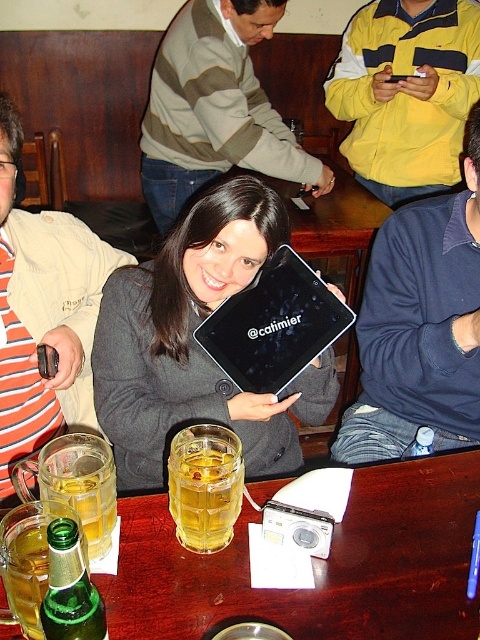
Does translucent glass mug at center have a larger size compared to green glass bottle at lower left?

Indeed, translucent glass mug at center has a larger size compared to green glass bottle at lower left.

Does point (197, 481) lie behind point (52, 557)?

That is True.

Who is more forward, (200, 481) or (48, 625)?

Point (48, 625) is in front.

You are a GUI agent. You are given a task and a screenshot of the screen. Output one action in this format:
    pyautogui.click(x=<x>, y=<y>)
    Task: Click on the translucent glass mug at center
    This screenshot has width=480, height=640.
    Given the screenshot: What is the action you would take?
    pyautogui.click(x=204, y=484)

Is wooden table at center bigger than striped sweater at center?

Incorrect, wooden table at center is not larger than striped sweater at center.

Between point (437, 516) and point (208, 163), which one is positioned in front?

Point (437, 516) is in front.

The width and height of the screenshot is (480, 640). What are the coordinates of `wooden table at center` in the screenshot? It's located at (314, 564).

Which of these two, dark blue sweater at center or green glass beer at lower left, stands shorter?

With less height is green glass beer at lower left.

Between dark blue sweater at center and green glass beer at lower left, which one is positioned lower?

Positioned lower is green glass beer at lower left.

Which is in front, point (422, 211) or point (96, 548)?

Point (96, 548)

Where is `dark blue sweater at center`? This screenshot has width=480, height=640. dark blue sweater at center is located at coordinates (420, 324).